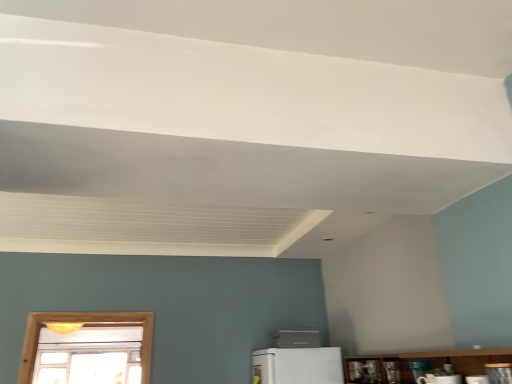
Question: Is the position of white plastic air conditioner at center, the 4th appliance in the top-to-bottom sequence, more distant than that of white glossy microwave at lower center, arranged as the second appliance when viewed from the front?

Choices:
 (A) no
 (B) yes

Answer: (B)

Question: Can you confirm if white plastic air conditioner at center, which is the first appliance from left to right, is wider than white glossy microwave at lower center, which is the third appliance in back-to-front order?

Choices:
 (A) yes
 (B) no

Answer: (A)

Question: From the image's perspective, is white plastic air conditioner at center, the 4th appliance in the top-to-bottom sequence, on top of white glossy microwave at lower center, the second appliance from the top?

Choices:
 (A) no
 (B) yes

Answer: (A)

Question: Does white plastic air conditioner at center, which ranks as the 4th appliance in front-to-back order, turn towards white glossy microwave at lower center, the 3th appliance viewed from the right?

Choices:
 (A) yes
 (B) no

Answer: (B)

Question: Is white plastic air conditioner at center, which is the first appliance from left to right, in contact with white glossy microwave at lower center, the 2th appliance in the left-to-right sequence?

Choices:
 (A) yes
 (B) no

Answer: (B)

Question: Is metallic silver toaster at lower right, which appears as the second appliance when viewed from the back, taller or shorter than white plastic air conditioner at center, the fourth appliance in the right-to-left sequence?

Choices:
 (A) short
 (B) tall

Answer: (A)

Question: In terms of size, does metallic silver toaster at lower right, the fourth appliance when ordered from left to right, appear bigger or smaller than white plastic air conditioner at center, which appears as the 1th appliance when viewed from the back?

Choices:
 (A) small
 (B) big

Answer: (A)

Question: Looking at their shapes, would you say metallic silver toaster at lower right, arranged as the 3th appliance when viewed from the front, is wider or thinner than white plastic air conditioner at center, the fourth appliance in the right-to-left sequence?

Choices:
 (A) wide
 (B) thin

Answer: (B)

Question: Is metallic silver toaster at lower right, arranged as the 3th appliance when viewed from the front, to the left or to the right of white plastic air conditioner at center, which is the first appliance from left to right, in the image?

Choices:
 (A) right
 (B) left

Answer: (A)

Question: Is point (424, 375) positioned closer to the camera than point (426, 370)?

Choices:
 (A) farther
 (B) closer

Answer: (A)

Question: Is white glossy microwave at lower center, the 3th appliance viewed from the right, to the left or to the right of metallic silver toaster at lower right, arranged as the 3th appliance when viewed from the front, in the image?

Choices:
 (A) left
 (B) right

Answer: (A)

Question: From a real-world perspective, is white glossy microwave at lower center, which appears as the third appliance when ordered from the bottom, positioned above or below metallic silver toaster at lower right, which appears as the second appliance when viewed from the back?

Choices:
 (A) below
 (B) above

Answer: (A)

Question: From the image's perspective, is white glossy microwave at lower center, arranged as the second appliance when viewed from the front, positioned above or below metallic silver toaster at lower right, the fourth appliance when ordered from left to right?

Choices:
 (A) below
 (B) above

Answer: (B)

Question: Looking at their shapes, would you say metallic silver toaster at lower right, which ranks as the third appliance in left-to-right order, is wider or thinner than white glossy microwave at lower center, arranged as the second appliance when viewed from the front?

Choices:
 (A) wide
 (B) thin

Answer: (A)

Question: Is metallic silver toaster at lower right, the second appliance viewed from the right, in front of or behind white glossy microwave at lower center, the second appliance from the top, in the image?

Choices:
 (A) front
 (B) behind

Answer: (A)